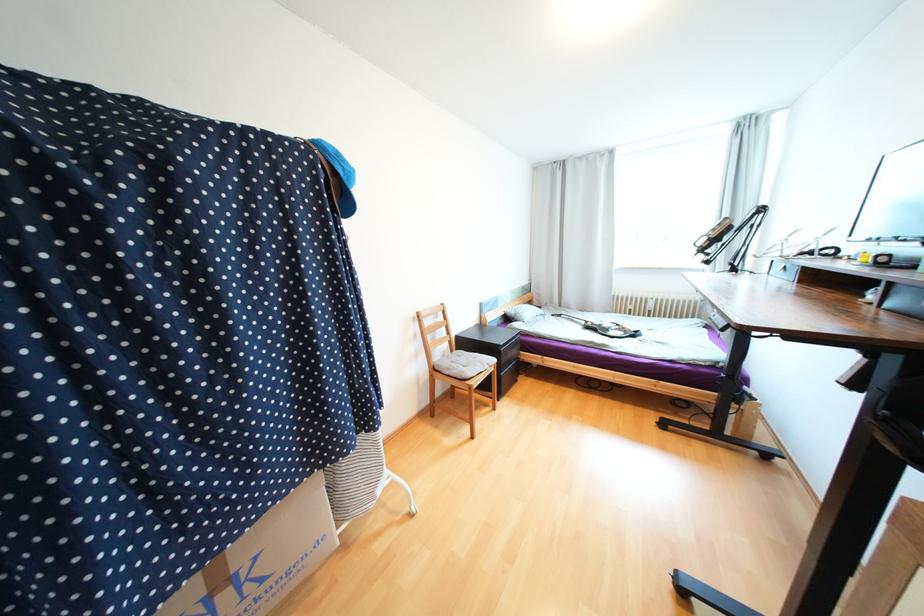
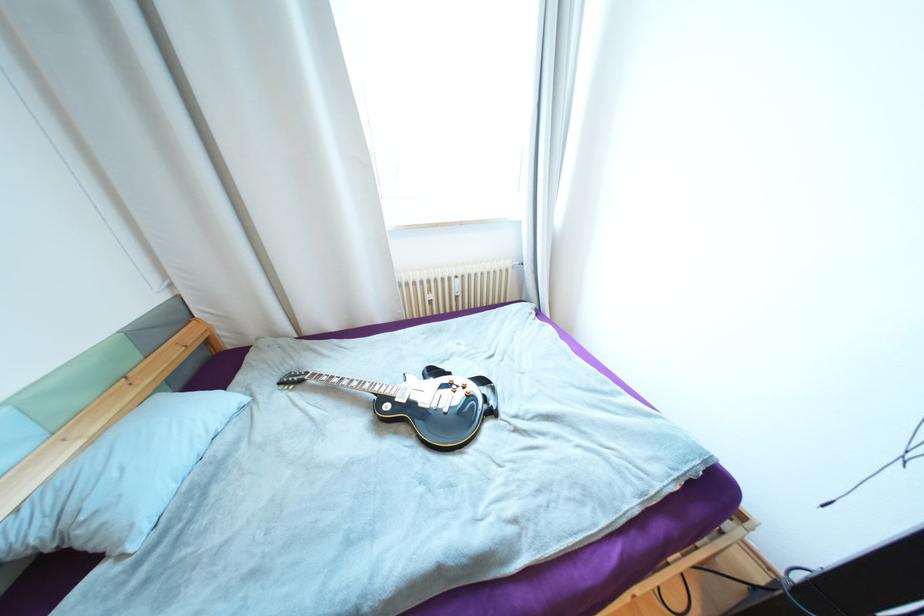
Locate, in the second image, the point that corresponds to the point at 655,312 in the first image.

(463, 297)